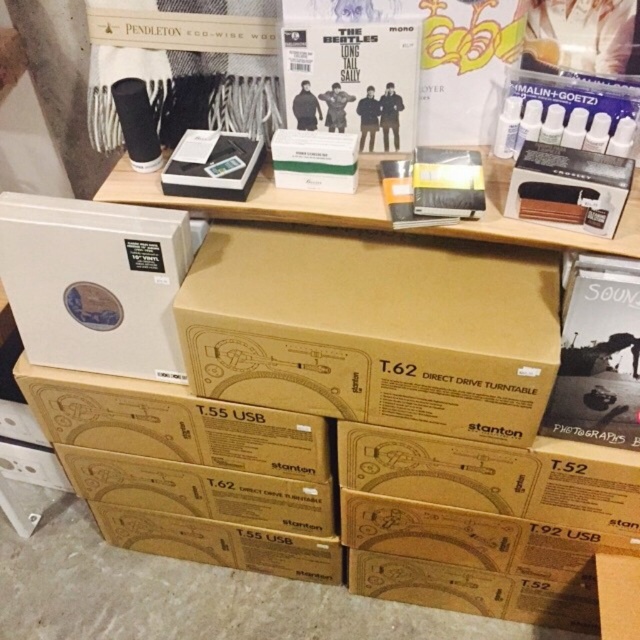
Question: Does brown cardboard box at center appear on the left side of matte cardboard box at lower right?

Choices:
 (A) yes
 (B) no

Answer: (A)

Question: Which point is farther from the camera taking this photo?

Choices:
 (A) (564, 387)
 (B) (284, 321)
 (C) (60, 348)

Answer: (C)

Question: Can you confirm if brown cardboard box at center is positioned below matte cardboard box at lower right?

Choices:
 (A) yes
 (B) no

Answer: (B)

Question: Is brown cardboard box at center thinner than matte cardboard box at lower right?

Choices:
 (A) no
 (B) yes

Answer: (A)

Question: Which point is farther to the camera?

Choices:
 (A) brown cardboard box at center
 (B) matte cardboard box at lower right
 (C) white matte vinyl record at lower left

Answer: (C)

Question: Considering the real-world distances, which object is closest to the white matte vinyl record at lower left?

Choices:
 (A) brown cardboard box at center
 (B) matte cardboard box at lower right

Answer: (A)